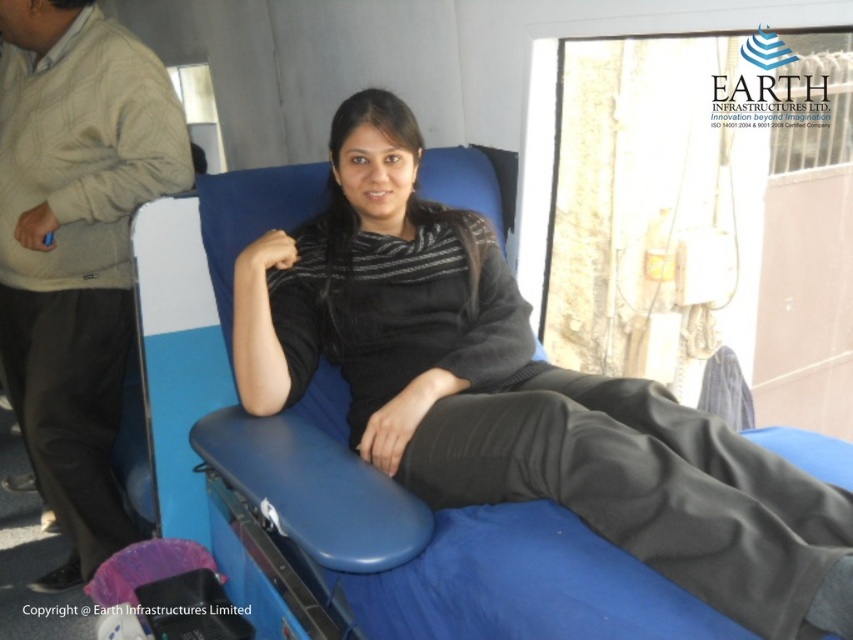
Question: Among these points, which one is nearest to the camera?

Choices:
 (A) (44, 352)
 (B) (752, 483)

Answer: (B)

Question: Is matte black sweater at center wider than matte beige coach at left?

Choices:
 (A) no
 (B) yes

Answer: (B)

Question: Does matte black sweater at center have a smaller size compared to matte beige coach at left?

Choices:
 (A) yes
 (B) no

Answer: (B)

Question: Is matte black sweater at center smaller than matte beige coach at left?

Choices:
 (A) no
 (B) yes

Answer: (A)